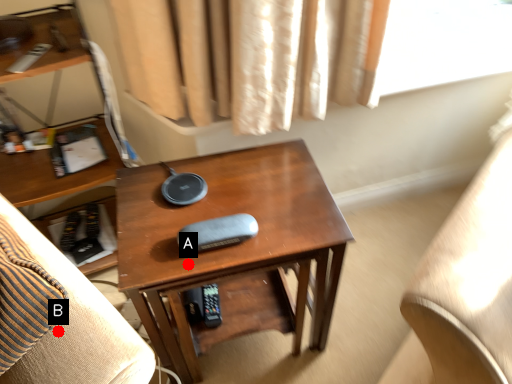
Question: Two points are circled on the image, labeled by A and B beside each circle. Which point is farther to the camera?

Choices:
 (A) A is further
 (B) B is further

Answer: (A)